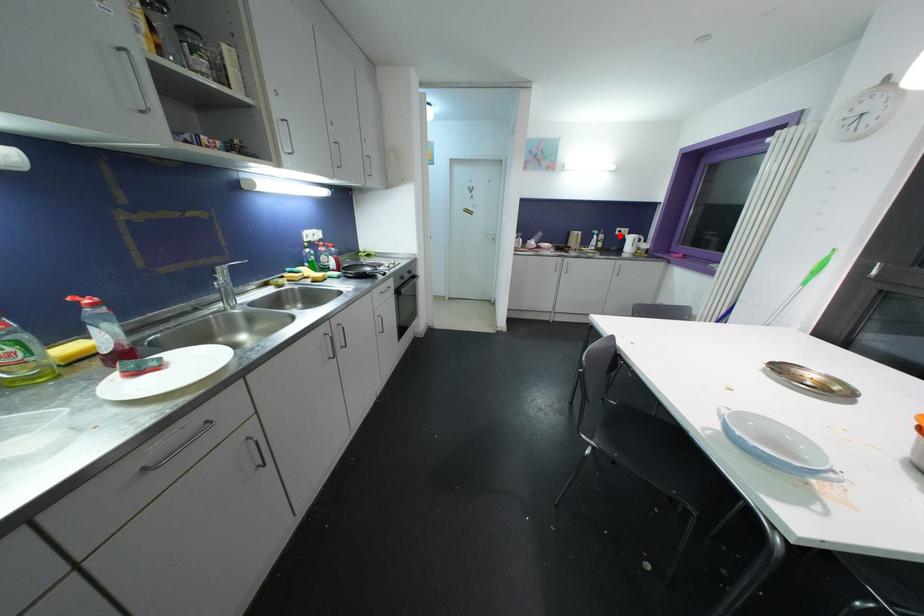
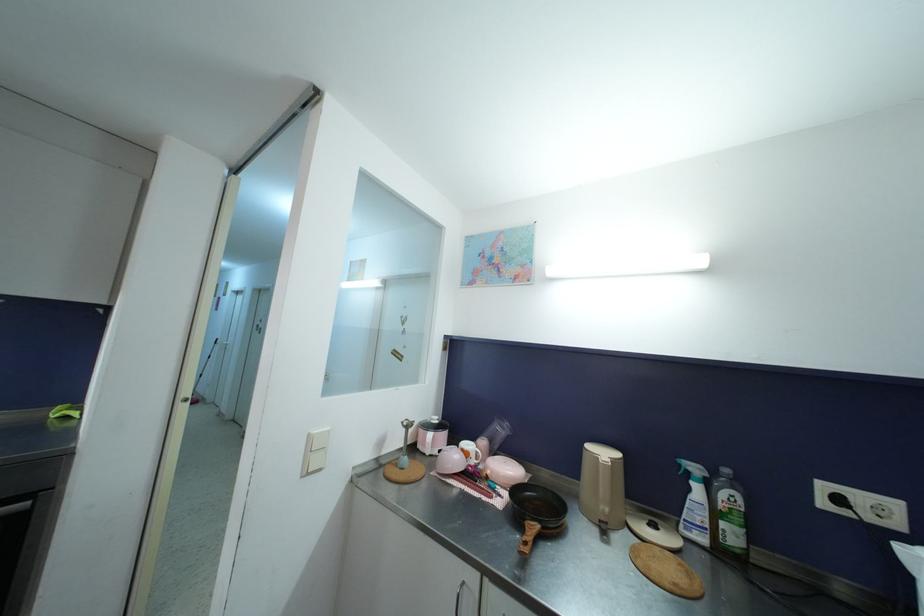
Find the pixel in the second image that matches the highlighted location in the first image.

(827, 507)